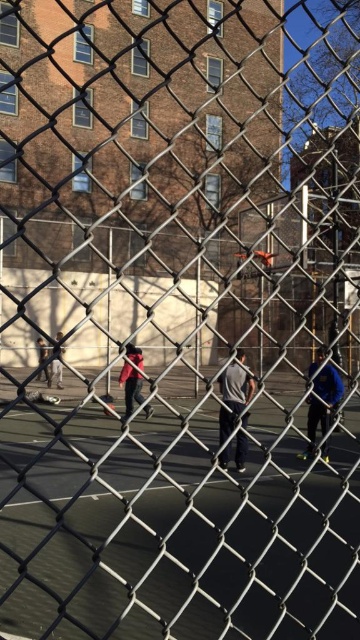
You are observing a basketball game through a fence and see two players wearing jackets. One is wearing a gray fabric jacket at center and the other a dark blue jacket at center. Which jacket is closer to you?

The gray fabric jacket at center is closer to you because it is further to the viewer than the dark blue jacket at center.

You are standing outside the basketball court and see two people wearing jackets at the center of the court. Which jacket is closer to you, the gray fabric jacket at center or the red fabric jacket at center?

The gray fabric jacket at center is closer to you because it is further to the viewer than the red fabric jacket at center.